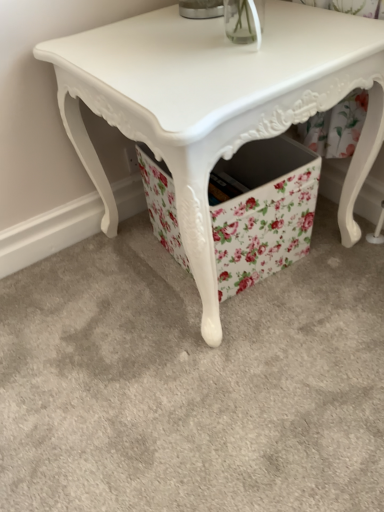
This screenshot has height=512, width=384. Find the location of `vacant space in front of white glossy table at center`. vacant space in front of white glossy table at center is located at coordinates (227, 392).